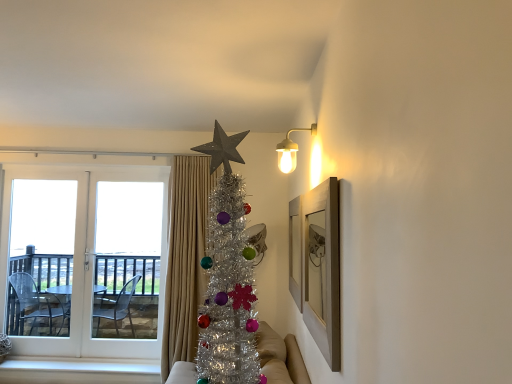
Where is `free space above white wood at lower left (from a real-world perspective)`? The image size is (512, 384). free space above white wood at lower left (from a real-world perspective) is located at coordinates pos(101,367).